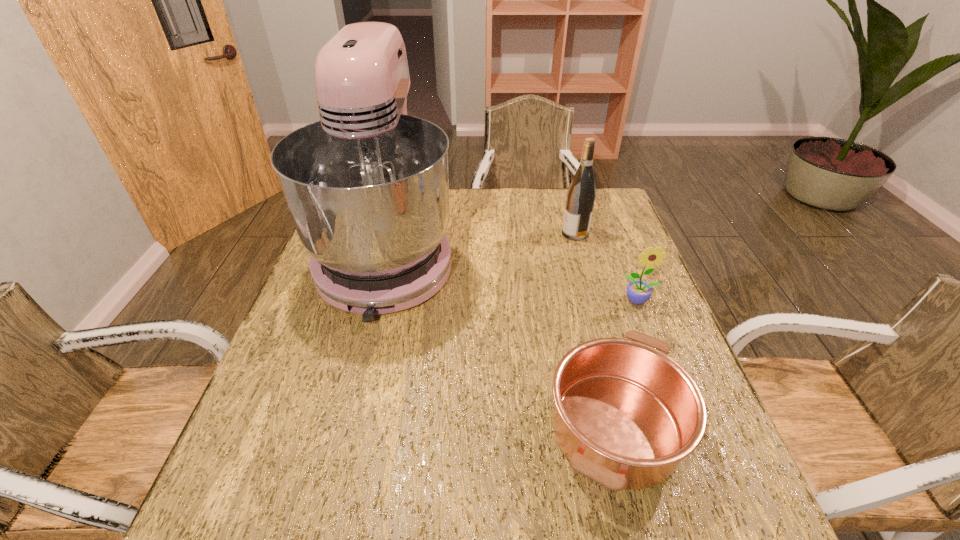
Where is `vacant space at the far edge of the desktop`? This screenshot has height=540, width=960. vacant space at the far edge of the desktop is located at coordinates (480, 201).

Image resolution: width=960 pixels, height=540 pixels. I want to click on vacant region at the near edge of the desktop, so click(x=401, y=509).

The width and height of the screenshot is (960, 540). Find the location of `vacant space at the left edge of the desktop`. vacant space at the left edge of the desktop is located at coordinates point(331,381).

Locate an element on the screen. This screenshot has width=960, height=540. vacant space at the right edge of the desktop is located at coordinates (598, 305).

Where is `unoccupied position between the tallest object and the wine bottle`? unoccupied position between the tallest object and the wine bottle is located at coordinates (481, 245).

Identify the location of free space that is in between the second shortest object and the tallest object. (513, 278).

The width and height of the screenshot is (960, 540). I want to click on free spot between the saucepan and the mixer, so click(x=501, y=342).

Locate an element on the screen. free space between the nearest object and the second tallest object is located at coordinates (595, 330).

Where is `vacant area between the mixer and the third tallest object`? vacant area between the mixer and the third tallest object is located at coordinates (513, 278).

The image size is (960, 540). Identify the location of free space between the second tallest object and the saucepan. (595, 330).